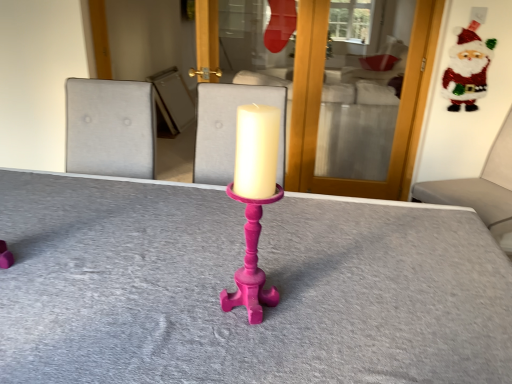
Question: Could matte pink candle holder at center be considered to be inside shiny glitter santa at upper right?

Choices:
 (A) yes
 (B) no

Answer: (B)

Question: Is shiny glitter santa at upper right in front of matte pink candle holder at center?

Choices:
 (A) no
 (B) yes

Answer: (A)

Question: Is shiny glitter santa at upper right not near matte pink candle holder at center?

Choices:
 (A) yes
 (B) no

Answer: (A)

Question: Is shiny glitter santa at upper right bigger than matte pink candle holder at center?

Choices:
 (A) yes
 (B) no

Answer: (A)

Question: From a real-world perspective, is shiny glitter santa at upper right under matte pink candle holder at center?

Choices:
 (A) no
 (B) yes

Answer: (A)

Question: From the image's perspective, relative to velvet grey cushion at right, is matte pink candlestick at center above or below?

Choices:
 (A) above
 (B) below

Answer: (B)

Question: Is matte pink candlestick at center to the left or to the right of velvet grey cushion at right in the image?

Choices:
 (A) left
 (B) right

Answer: (A)

Question: From a real-world perspective, is matte pink candlestick at center physically located above or below velvet grey cushion at right?

Choices:
 (A) below
 (B) above

Answer: (A)

Question: Is matte pink candlestick at center wider or thinner than velvet grey cushion at right?

Choices:
 (A) wide
 (B) thin

Answer: (A)

Question: Is matte pink candle holder at center wider or thinner than matte pink candlestick at center?

Choices:
 (A) wide
 (B) thin

Answer: (B)

Question: Choose the correct answer: Is matte pink candle holder at center inside matte pink candlestick at center or outside it?

Choices:
 (A) outside
 (B) inside

Answer: (A)

Question: Relative to matte pink candlestick at center, is matte pink candle holder at center in front or behind?

Choices:
 (A) behind
 (B) front

Answer: (A)

Question: From the image's perspective, is matte pink candle holder at center above or below matte pink candlestick at center?

Choices:
 (A) below
 (B) above

Answer: (B)

Question: Would you say shiny glitter santa at upper right is inside or outside matte pink candle holder at center?

Choices:
 (A) inside
 (B) outside

Answer: (B)

Question: In terms of height, does shiny glitter santa at upper right look taller or shorter compared to matte pink candle holder at center?

Choices:
 (A) tall
 (B) short

Answer: (A)